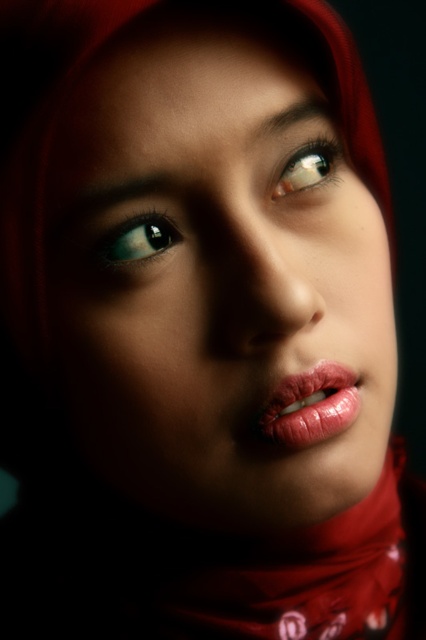
You are a photographer adjusting the focus of your camera. You want to ensure that both the matte red hijab at center and the shiny brown eye at upper center are in focus. Which object should you focus on first to achieve this?

You should focus on the matte red hijab at center first because it is closer to the viewer than the shiny brown eye at upper center. By focusing on the closer object, the depth of field may extend to include the farther object in acceptable focus.

You are an artist analyzing the portrait. You notice two points in the image at coordinates point (293, 417) and point (293, 173). Which of these points is positioned closer to the viewer?

→ Point (293, 417) is closer to the viewer than point (293, 173).

You are a makeup artist analyzing the portrait. The shiny pink lips at center are positioned at coordinates. Where exactly are they placed in relation to the headscarf?

The shiny pink lips at center are located at point coordinates, which places them in the lower central area of the face, below the nose and above the chin, typical for lips placement relative to the headscarf.